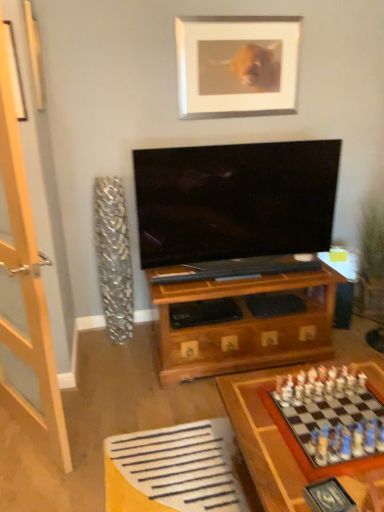
Identify the location of vacant space behind clear glass door at left. (96, 377).